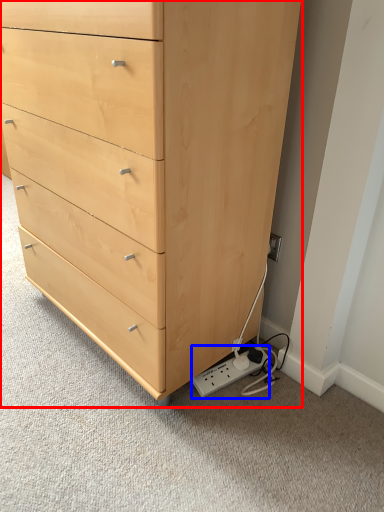
Question: Which object appears farthest to the camera in this image, chest of drawers (highlighted by a red box) or plug (highlighted by a blue box)?

Choices:
 (A) chest of drawers
 (B) plug

Answer: (B)